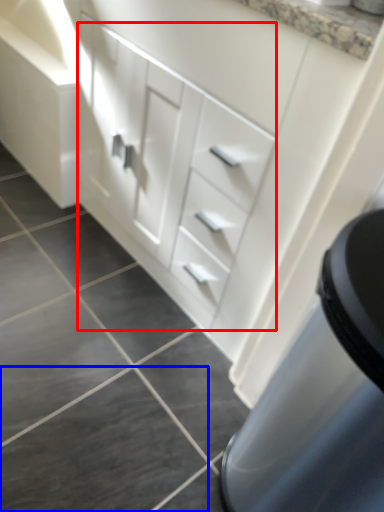
Question: Which of the following is the farthest to the observer, drawer (highlighted by a red box) or tile (highlighted by a blue box)?

Choices:
 (A) drawer
 (B) tile

Answer: (B)